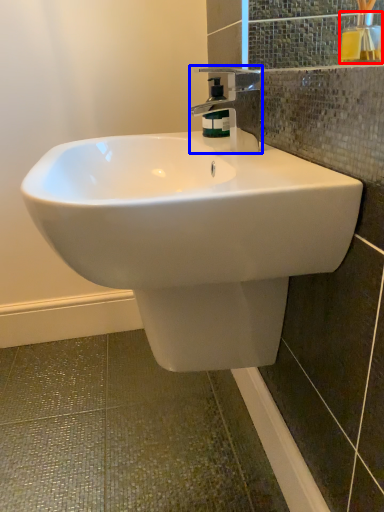
Question: Which object is closer to the camera taking this photo, mouthwash (highlighted by a red box) or tap (highlighted by a blue box)?

Choices:
 (A) mouthwash
 (B) tap

Answer: (B)